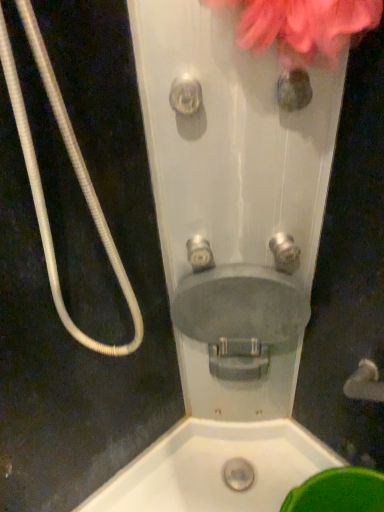
Question: Which direction should I rotate to look at brushed metal faucet at center, which ranks as the 1th plumbing fixture in right-to-left order, — up or down?

Choices:
 (A) up
 (B) down

Answer: (A)

Question: Is satin silver faucet at center, marked as the second plumbing fixture in a right-to-left arrangement, not near white corrugated hose at left?

Choices:
 (A) yes
 (B) no

Answer: (B)

Question: Considering the relative sizes of satin silver faucet at center, marked as the second plumbing fixture in a right-to-left arrangement, and white corrugated hose at left in the image provided, is satin silver faucet at center, marked as the second plumbing fixture in a right-to-left arrangement, taller than white corrugated hose at left?

Choices:
 (A) no
 (B) yes

Answer: (A)

Question: Does satin silver faucet at center, which is the first plumbing fixture in left-to-right order, have a smaller size compared to white corrugated hose at left?

Choices:
 (A) no
 (B) yes

Answer: (B)

Question: Can you confirm if satin silver faucet at center, marked as the second plumbing fixture in a right-to-left arrangement, is positioned to the left of white corrugated hose at left?

Choices:
 (A) yes
 (B) no

Answer: (B)

Question: Is satin silver faucet at center, which is the first plumbing fixture in left-to-right order, at the right side of white corrugated hose at left?

Choices:
 (A) no
 (B) yes

Answer: (B)

Question: Is satin silver faucet at center, marked as the second plumbing fixture in a right-to-left arrangement, next to white corrugated hose at left and touching it?

Choices:
 (A) no
 (B) yes

Answer: (A)

Question: Is white corrugated hose at left thinner than matte gray sink at center?

Choices:
 (A) yes
 (B) no

Answer: (B)

Question: Is white corrugated hose at left facing towards matte gray sink at center?

Choices:
 (A) no
 (B) yes

Answer: (A)

Question: Is white corrugated hose at left closer to camera compared to matte gray sink at center?

Choices:
 (A) no
 (B) yes

Answer: (B)

Question: Is white corrugated hose at left positioned with its back to matte gray sink at center?

Choices:
 (A) yes
 (B) no

Answer: (B)

Question: From a real-world perspective, is white corrugated hose at left under matte gray sink at center?

Choices:
 (A) no
 (B) yes

Answer: (A)

Question: From a real-world perspective, is white corrugated hose at left on top of matte gray sink at center?

Choices:
 (A) no
 (B) yes

Answer: (B)

Question: Does brushed metal faucet at center, the 2th plumbing fixture from the left, have a lesser height compared to matte gray sink at center?

Choices:
 (A) yes
 (B) no

Answer: (A)